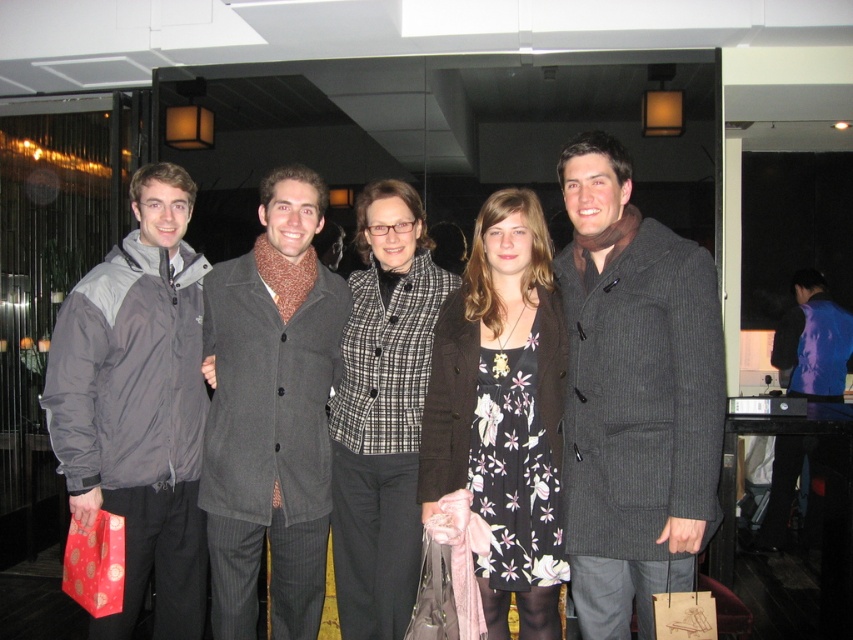
Question: Is plaid wool jacket at center to the right of blue shiny jacket at center from the viewer's perspective?

Choices:
 (A) yes
 (B) no

Answer: (B)

Question: Where is dark gray pinstripe coat at center located in relation to gray synthetic jacket at left in the image?

Choices:
 (A) left
 (B) right

Answer: (B)

Question: Which point is closer to the camera taking this photo?

Choices:
 (A) (560, 484)
 (B) (592, 240)

Answer: (B)

Question: Which point is closer to the camera?

Choices:
 (A) matte black jacket at center
 (B) plaid wool jacket at center
 (C) blue shiny jacket at center
 (D) dark gray pinstripe coat at center

Answer: (D)

Question: Can you confirm if dark gray pinstripe coat at center is positioned to the left of matte black jacket at center?

Choices:
 (A) yes
 (B) no

Answer: (B)

Question: Which of the following is the farthest from the observer?

Choices:
 (A) (851, 328)
 (B) (442, 365)
 (C) (122, 406)

Answer: (A)